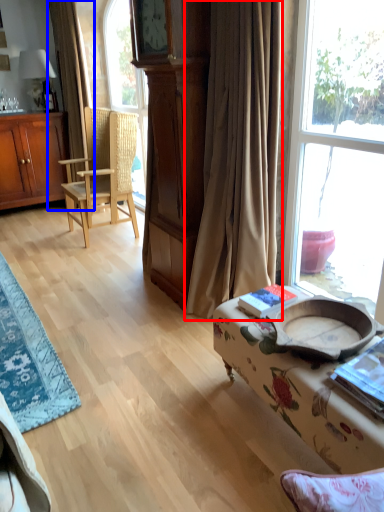
Question: Which object is closer to the camera taking this photo, curtain (highlighted by a red box) or curtain (highlighted by a blue box)?

Choices:
 (A) curtain
 (B) curtain

Answer: (A)